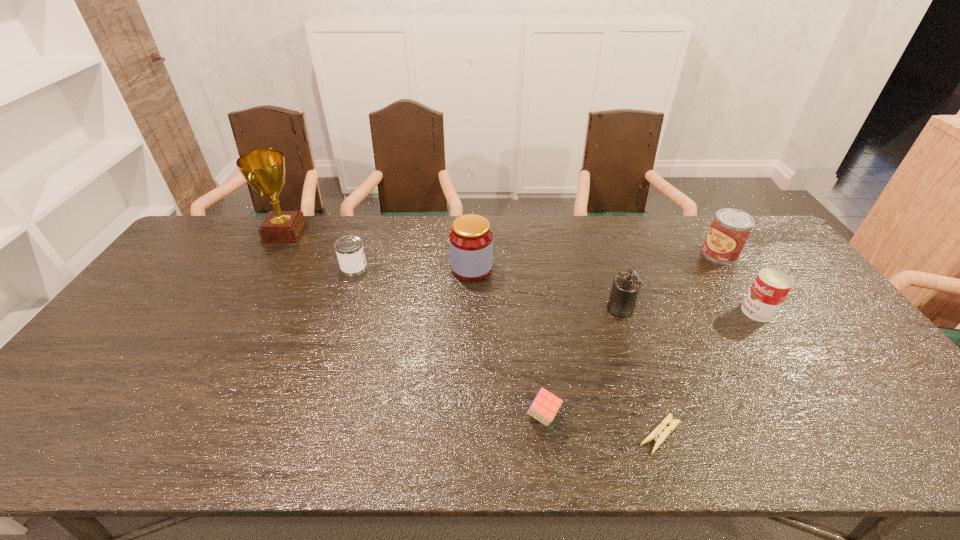
Image resolution: width=960 pixels, height=540 pixels. I want to click on vacant space that satisfies the following two spatial constraints: 1. on the plaque of the seventh object from right to left; 2. on the left side of the leftmost object, so click(x=265, y=268).

I want to click on free space that satisfies the following two spatial constraints: 1. on the plaque of the shortest object; 2. on the left side of the leftmost object, so click(169, 435).

Identify the location of free spot that satisfies the following two spatial constraints: 1. on the plaque of the fifth object from right to left; 2. on the left side of the tallest object. (180, 416).